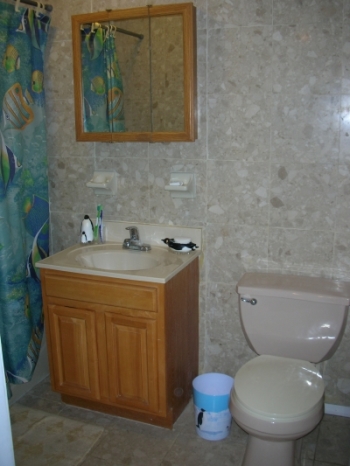
The height and width of the screenshot is (466, 350). What are the coordinates of `sink` in the screenshot? It's located at (125, 258).